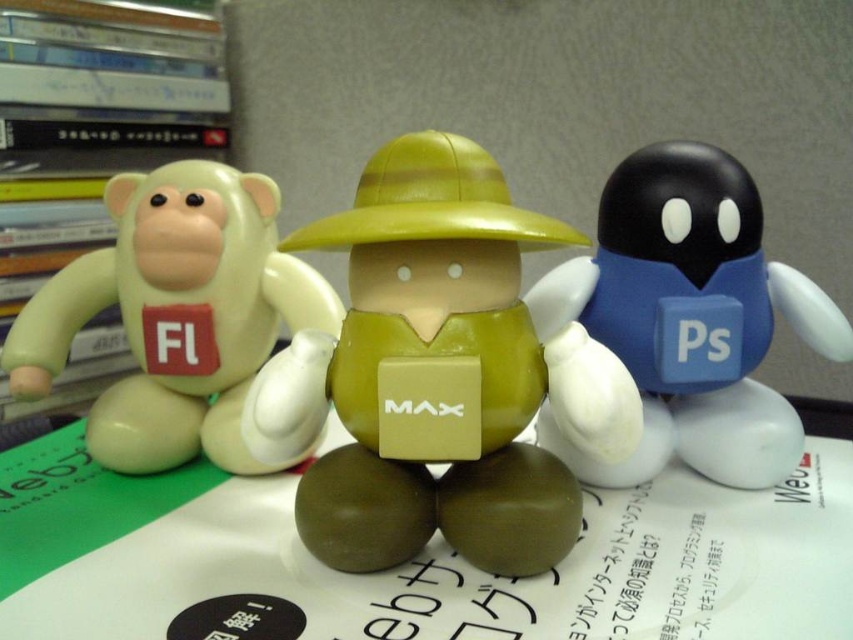
Between blue matte/soft toy at right and matte green plastic monkey at left, which one appears on the left side from the viewer's perspective?

matte green plastic monkey at left is more to the left.

Which is in front, point (697, 346) or point (175, 260)?

Point (697, 346) is more forward.

Identify the location of blue matte/soft toy at right. (688, 317).

Which of these two, matte green figure at center or blue matte/soft toy at right, stands taller?

With more height is matte green figure at center.

Which is behind, point (310, 522) or point (648, 188)?

The point (648, 188) is behind.

Where is `matte green figure at center`? This screenshot has width=853, height=640. matte green figure at center is located at coordinates (451, 372).

Which is below, matte green figure at center or matte green plastic monkey at left?

Positioned lower is matte green figure at center.

Which is above, matte green figure at center or matte green plastic monkey at left?

matte green plastic monkey at left

Identify the location of matte green figure at center. (451, 372).